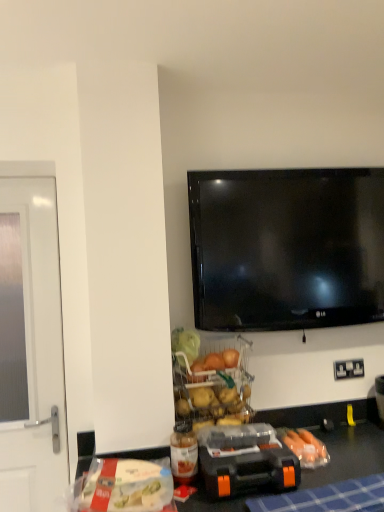
I want to click on free space above white plastic bag at lower left (from a real-world perspective), so click(x=129, y=496).